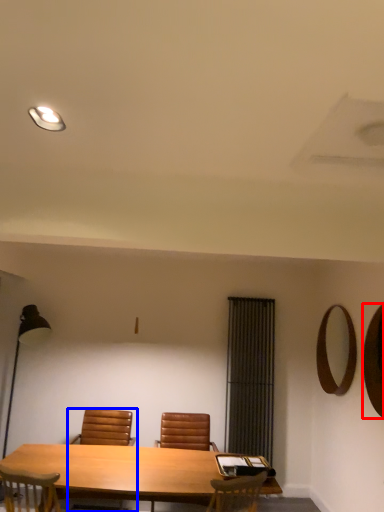
Question: Which object appears farthest to the camera in this image, mirror (highlighted by a red box) or chair (highlighted by a blue box)?

Choices:
 (A) mirror
 (B) chair

Answer: (B)